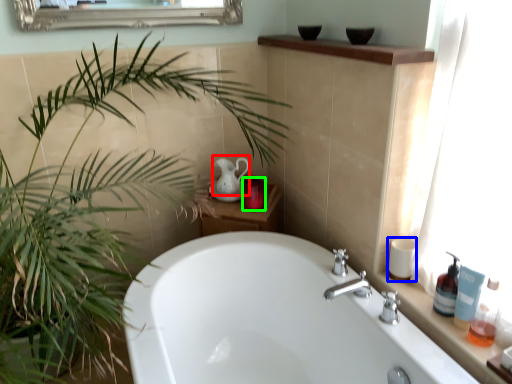
Question: Which object is positioned farthest from tea pot (highlighted by a red box)? Select from toiletry (highlighted by a blue box) and toiletry (highlighted by a green box).

Choices:
 (A) toiletry
 (B) toiletry

Answer: (A)